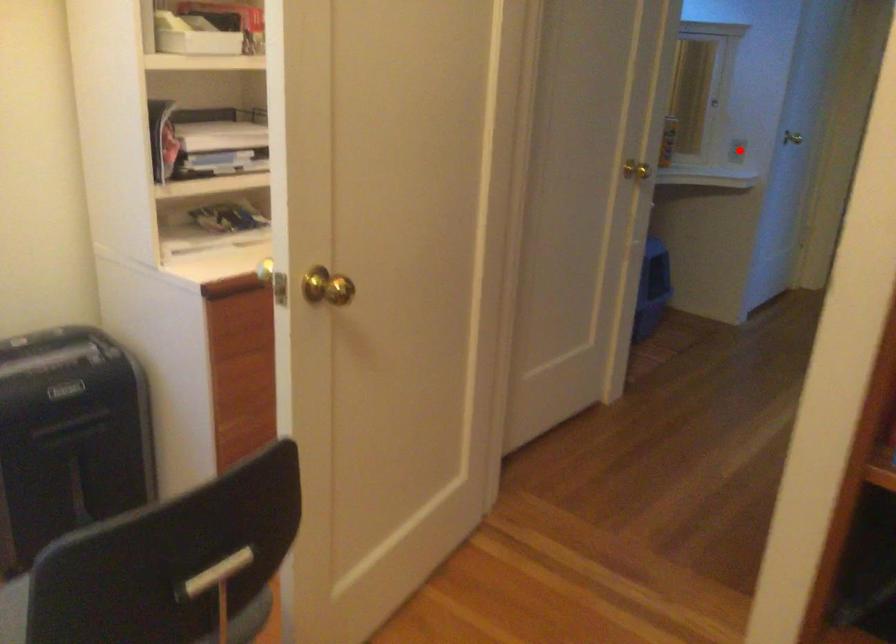
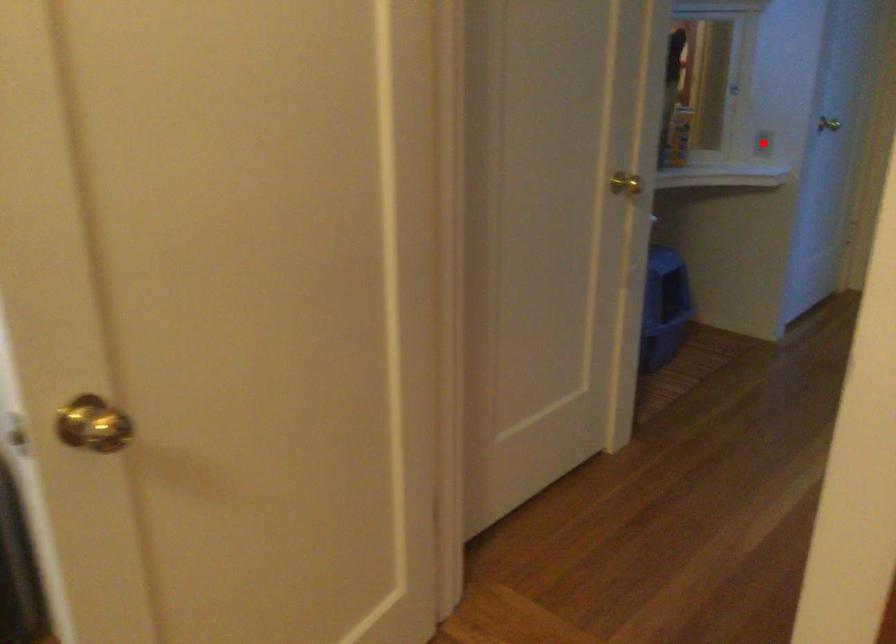
I am providing you with two images of the same scene from different viewpoints. A red point is marked on the first image and another point is marked on the second image. Are the points marked in image1 and image2 representing the same 3D position?

Yes